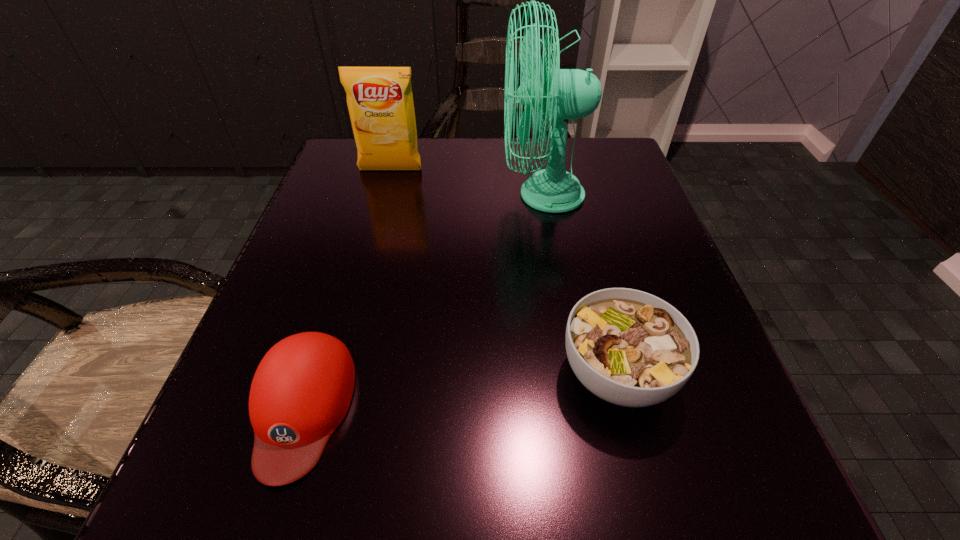
Find the location of a particular element. free region at the near edge of the desktop is located at coordinates (444, 471).

Identify the location of vacant space at the left edge. This screenshot has height=540, width=960. (321, 327).

Find the location of a particular element. This screenshot has width=960, height=540. blank space at the right edge of the desktop is located at coordinates (702, 413).

In the image, there is a desktop. Identify the location of vacant space at the far left corner. (349, 183).

Find the location of a particular element. The width and height of the screenshot is (960, 540). vacant space at the far right corner of the desktop is located at coordinates (607, 173).

What are the coordinates of `vacant space at the near right corner of the desktop` in the screenshot? It's located at (694, 478).

At what (x,y) coordinates should I click in order to perform the action: click on unoccupied area between the fan and the second tallest object. Please return your answer as a coordinate pair (x, y). The height and width of the screenshot is (540, 960). Looking at the image, I should click on (467, 183).

This screenshot has height=540, width=960. I want to click on free spot between the baseball cap and the soup bowl, so click(x=460, y=391).

Where is `free space between the baseball cap and the crisp (potato chip)`? free space between the baseball cap and the crisp (potato chip) is located at coordinates (347, 289).

Find the location of `vacant space in between the baseball cap and the fan`. vacant space in between the baseball cap and the fan is located at coordinates tap(422, 301).